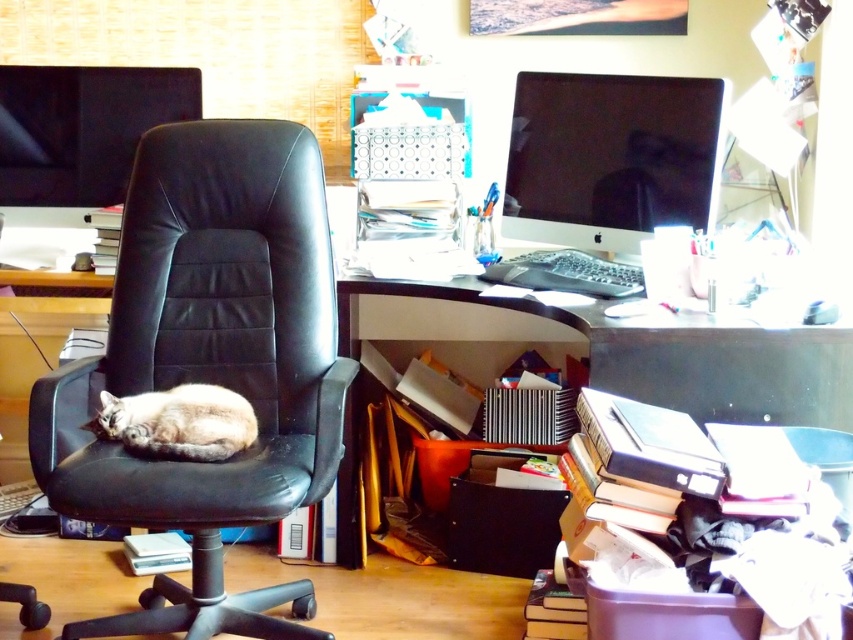
Which is more to the left, black glossy monitor at upper center or fuzzy beige cat at center?

From the viewer's perspective, fuzzy beige cat at center appears more on the left side.

This screenshot has width=853, height=640. Describe the element at coordinates (608, 156) in the screenshot. I see `black glossy monitor at upper center` at that location.

Locate an element on the screen. The width and height of the screenshot is (853, 640). black glossy monitor at upper center is located at coordinates (608, 156).

Is black leather swivel chair at left bigger than wooden desk at lower right?

Actually, black leather swivel chair at left might be smaller than wooden desk at lower right.

Between black leather swivel chair at left and wooden desk at lower right, which one appears on the left side from the viewer's perspective?

black leather swivel chair at left

Does point (61, 420) lie in front of point (668, 372)?

No, (61, 420) is further to viewer.

This screenshot has height=640, width=853. Identify the location of black leather swivel chair at left. coord(209,364).

Does wooden desk at lower right have a lesser width compared to fuzzy beige cat at center?

In fact, wooden desk at lower right might be wider than fuzzy beige cat at center.

Image resolution: width=853 pixels, height=640 pixels. What do you see at coordinates (613, 349) in the screenshot?
I see `wooden desk at lower right` at bounding box center [613, 349].

Identify the location of wooden desk at lower right. (613, 349).